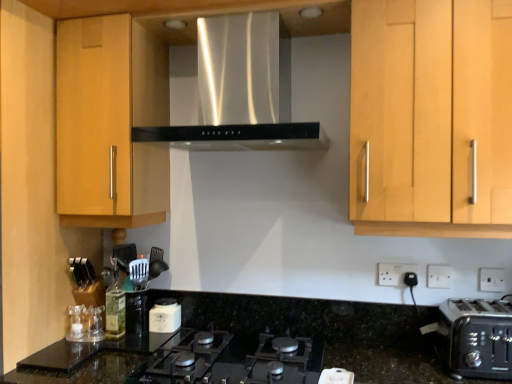
Question: Considering the positions of white plastic electric outlet at lower right, placed as the 3th electric outlet when sorted from right to left, and white matte jar at center in the image, is white plastic electric outlet at lower right, placed as the 3th electric outlet when sorted from right to left, wider or thinner than white matte jar at center?

Choices:
 (A) wide
 (B) thin

Answer: (B)

Question: Relative to white matte jar at center, is white plastic electric outlet at lower right, acting as the 1th electric outlet starting from the left, in front or behind?

Choices:
 (A) front
 (B) behind

Answer: (A)

Question: Which is nearer to the black granite countertop at center?

Choices:
 (A) black glass gas stove at lower center
 (B) black plastic toaster at lower right
 (C) white plastic electric outlet at lower right, the 3th electric outlet in the front-to-back sequence
 (D) white plastic electric outlet at upper right, the first electric outlet when ordered from front to back
 (E) white matte jar at center

Answer: (A)

Question: Which is nearer to the black glass gas stove at lower center?

Choices:
 (A) white plastic electric outlet at lower right, acting as the 1th electric outlet starting from the left
 (B) white plastic electric outlet at lower right, which appears as the second electric outlet when viewed from the left
 (C) black plastic toaster at lower right
 (D) green glass bottle at lower left
 (E) stainless steel range hood at center

Answer: (D)